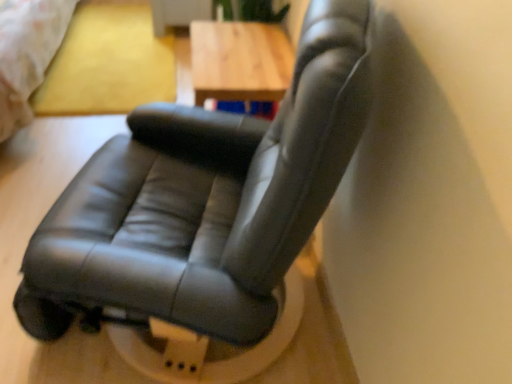
Question: Is black leather chair at center looking in the opposite direction of wooden table at center?

Choices:
 (A) no
 (B) yes

Answer: (A)

Question: From a real-world perspective, is black leather chair at center under wooden table at center?

Choices:
 (A) yes
 (B) no

Answer: (A)

Question: From the image's perspective, is black leather chair at center under wooden table at center?

Choices:
 (A) yes
 (B) no

Answer: (A)

Question: Does black leather chair at center have a greater width compared to wooden table at center?

Choices:
 (A) yes
 (B) no

Answer: (A)

Question: Is black leather chair at center thinner than wooden table at center?

Choices:
 (A) yes
 (B) no

Answer: (B)

Question: From a real-world perspective, is matte yellow bed at upper left above or below black leather chair at center?

Choices:
 (A) above
 (B) below

Answer: (A)

Question: Considering the positions of point (41, 36) and point (53, 281), is point (41, 36) closer or farther from the camera than point (53, 281)?

Choices:
 (A) closer
 (B) farther

Answer: (B)

Question: Is matte yellow bed at upper left situated inside black leather chair at center or outside?

Choices:
 (A) outside
 (B) inside

Answer: (A)

Question: In the image, is matte yellow bed at upper left positioned in front of or behind black leather chair at center?

Choices:
 (A) behind
 (B) front

Answer: (A)

Question: Looking at the image, does black leather chair at center seem bigger or smaller compared to wooden table at center?

Choices:
 (A) big
 (B) small

Answer: (A)

Question: Relative to wooden table at center, is black leather chair at center in front or behind?

Choices:
 (A) behind
 (B) front

Answer: (B)

Question: From the image's perspective, relative to wooden table at center, is black leather chair at center above or below?

Choices:
 (A) below
 (B) above

Answer: (A)

Question: From a real-world perspective, is black leather chair at center above or below wooden table at center?

Choices:
 (A) below
 (B) above

Answer: (A)

Question: Is black leather chair at center wider or thinner than matte yellow bed at upper left?

Choices:
 (A) thin
 (B) wide

Answer: (B)

Question: Is point (251, 258) closer or farther from the camera than point (42, 36)?

Choices:
 (A) closer
 (B) farther

Answer: (A)